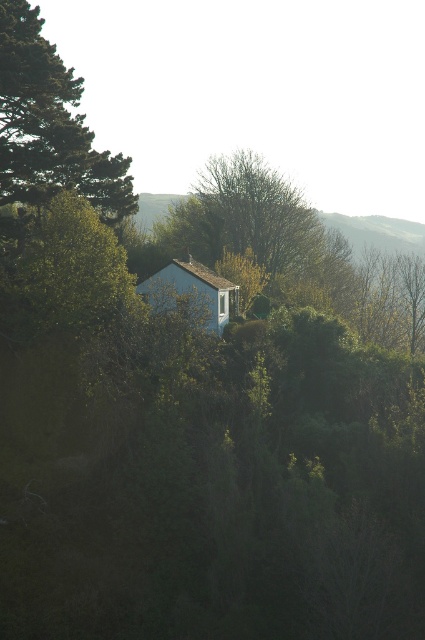
You are standing in the rural scene and want to walk from the green leafy tree at left to the blue matte hut at center. Which direction should you move relative to the tree?

You should move towards the blue matte hut at center, which is behind the green leafy tree at left since the tree is closer to you than the hut.

You are planning to install a new satellite dish on the tallest object in the scene. Which object should you choose between the green leafy tree at left and the blue matte hut at center?

The green leafy tree at left is taller than the blue matte hut at center, so you should install the satellite dish on the green leafy tree at left.